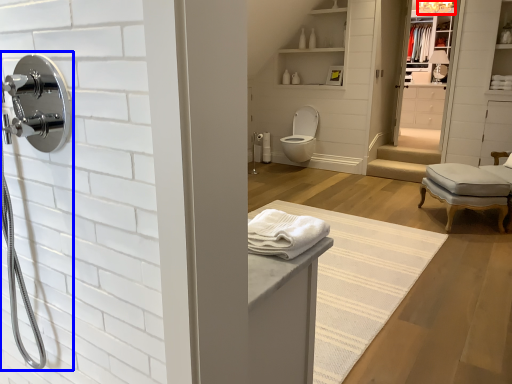
Question: Which object appears farthest to the camera in this image, light fixture (highlighted by a red box) or shower (highlighted by a blue box)?

Choices:
 (A) light fixture
 (B) shower

Answer: (A)